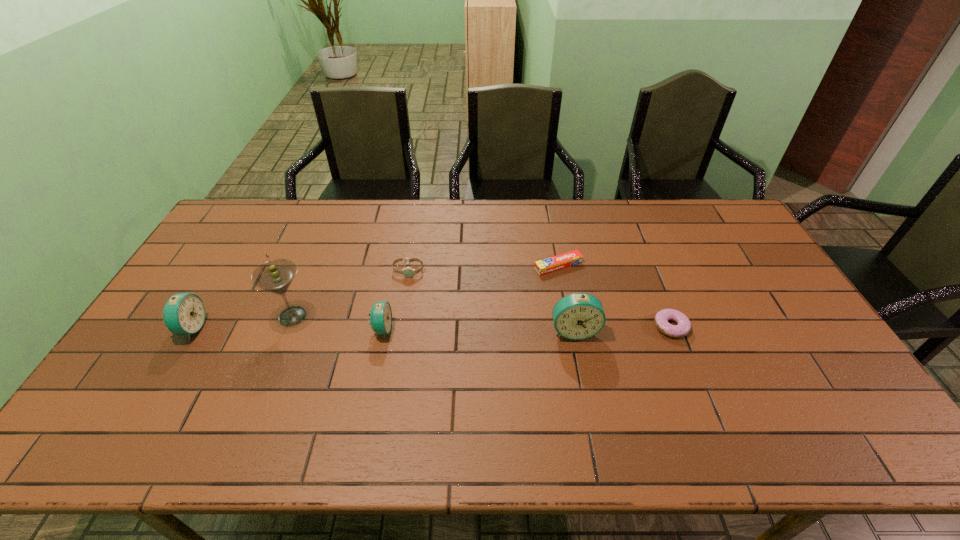
Identify the location of doughnut. (683, 326).

The height and width of the screenshot is (540, 960). In order to click on vacant space located 0.060m on the front-facing side of the leftmost object in this screenshot , I will do `click(225, 328)`.

You are a GUI agent. You are given a task and a screenshot of the screen. Output one action in this format:
    pyautogui.click(x=<x>, y=<y>)
    Task: Click on the free location located 0.230m on the front-facing side of the second alarm clock from left to right
    This screenshot has height=540, width=960.
    Given the screenshot: What is the action you would take?
    pos(473,329)

Find the location of a particular element. This screenshot has width=960, height=540. vacant space situated 0.190m on the front-facing side of the sixth shortest object is located at coordinates (588, 404).

Find the location of `free region located on the back of the tallest object`. free region located on the back of the tallest object is located at coordinates (309, 274).

Where is `free location located 0.270m on the face of the fifth tallest object`? free location located 0.270m on the face of the fifth tallest object is located at coordinates (396, 346).

What are the coordinates of `free spot located 0.070m on the back of the toothpaste` in the screenshot? It's located at 554,242.

Locate an element on the screen. blank space located 0.260m on the back of the rightmost object is located at coordinates (642, 255).

Where is `object present at the left edge`? The height and width of the screenshot is (540, 960). object present at the left edge is located at coordinates (184, 313).

Locate an element on the screen. Image resolution: width=960 pixels, height=540 pixels. free spot at the far edge of the desktop is located at coordinates (580, 200).